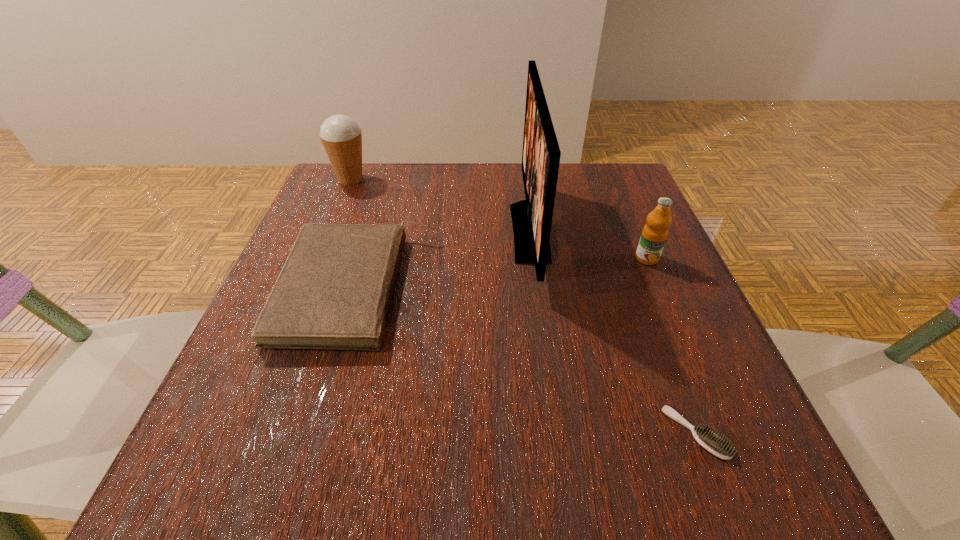
The height and width of the screenshot is (540, 960). In order to click on the third object from right to left in this screenshot , I will do `click(532, 218)`.

I want to click on monitor, so click(532, 218).

Locate an element on the screen. This screenshot has height=540, width=960. the second tallest object is located at coordinates (341, 136).

This screenshot has height=540, width=960. Find the location of `the third tallest object`. the third tallest object is located at coordinates (655, 232).

Image resolution: width=960 pixels, height=540 pixels. Find the location of `the fourth tallest object`. the fourth tallest object is located at coordinates (334, 290).

Where is `the shortest object`? the shortest object is located at coordinates (716, 445).

This screenshot has height=540, width=960. In order to click on scrubbing brush in this screenshot , I will do `click(716, 445)`.

Find the location of `free space located 0.350m on the front-facing side of the monitor`. free space located 0.350m on the front-facing side of the monitor is located at coordinates (347, 232).

Find the location of a particular element. The height and width of the screenshot is (540, 960). vacant space located 0.300m on the front-facing side of the monitor is located at coordinates (371, 232).

The image size is (960, 540). Identify the location of free space located on the front-facing side of the monitor. pyautogui.click(x=366, y=232).